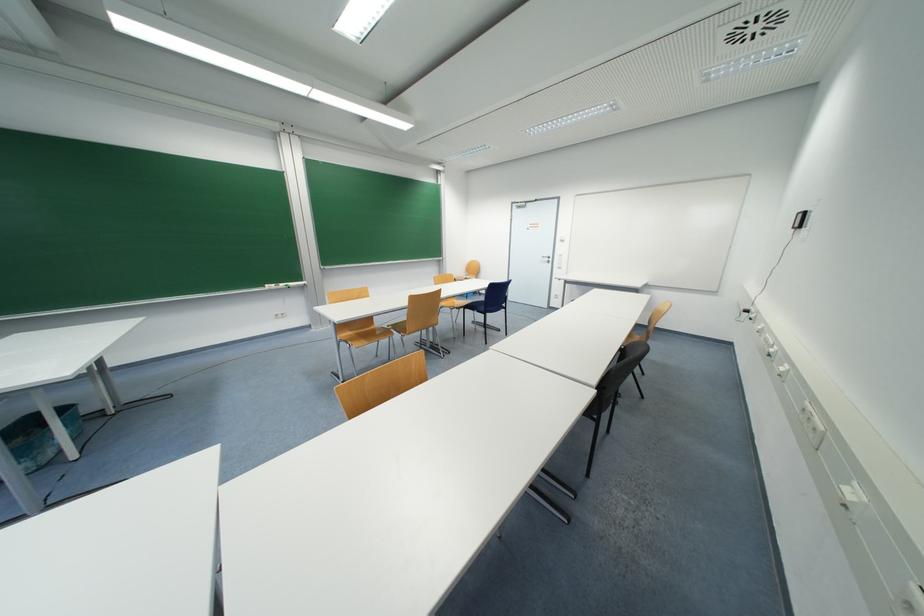
Where would you sit the blue chair sitting surface? Please return your answer as a coordinate pair (x, y).

(482, 302)